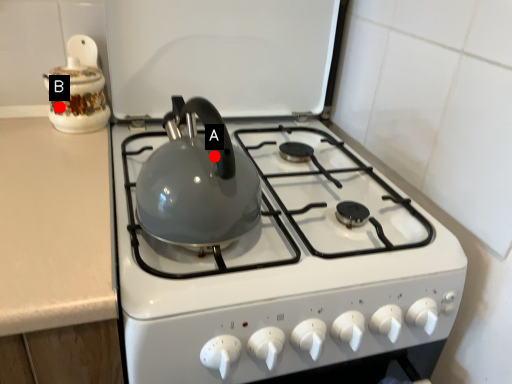
Question: Two points are circled on the image, labeled by A and B beside each circle. Which point is closer to the camera taking this photo?

Choices:
 (A) A is closer
 (B) B is closer

Answer: (A)